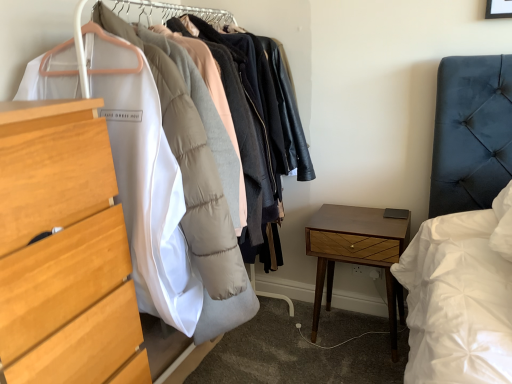
This screenshot has width=512, height=384. In order to click on vacant region below wooden nightstand at lower right (from a real-world perspective) in this screenshot , I will do [362, 327].